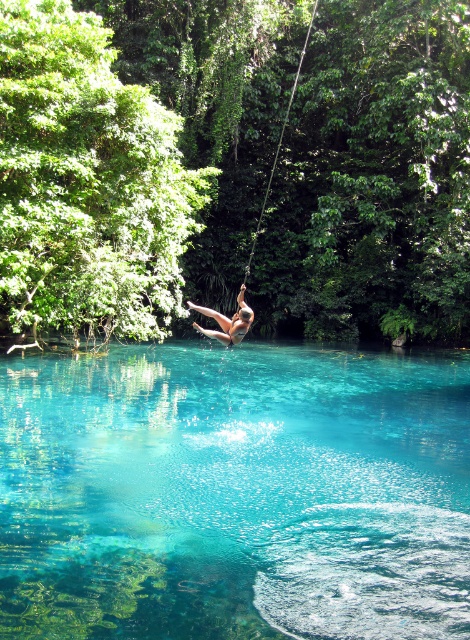
You are standing at the point marked as point (76, 602) and want to jump into the water. The rope swing is 16.12 feet away from you. Can you safely reach the water without hitting the rope swing?

Yes, you can safely jump into the water because the distance between you and the rope swing is 16.12 feet, which is sufficient to avoid collision.

You are standing at the edge of the water and want to take a photo of the smooth skin person at center swinging over the transparent water at center. Since the person is moving, you need to focus on the closest object first. Which object should you focus on first?

The transparent water at center is closer to the viewer than the smooth skin person at center, so you should focus on the transparent water at center first.

You are observing the scene from the camera position. There are two points marked in the image, point (16, 589) and point (242, 307). Which of these points is nearer to your current viewpoint?

Point (16, 589) is closer to the camera than point (242, 307).